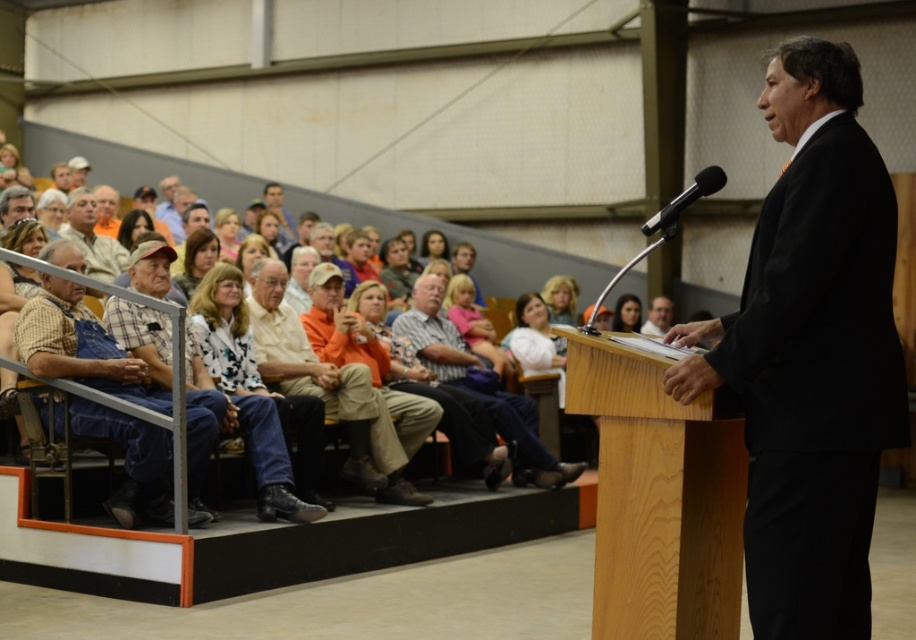
You are a photographer at the event and want to capture a photo that includes both the plaid shirt at center and the light brown leather jacket at upper center. Based on their positions, which one should you focus on first to ensure both are in frame?

The plaid shirt at center is below the light brown leather jacket at upper center, so you should focus on the light brown leather jacket at upper center first to ensure both are in frame.